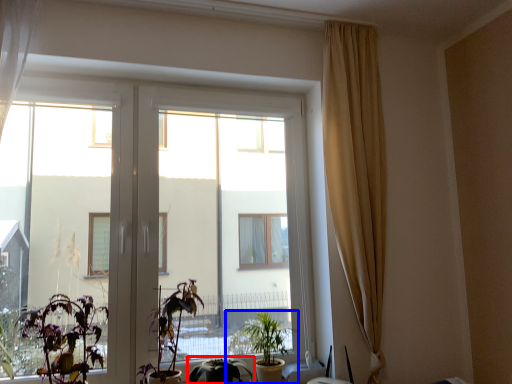
Question: Among these objects, which one is nearest to the camera, houseplant (highlighted by a red box) or houseplant (highlighted by a blue box)?

Choices:
 (A) houseplant
 (B) houseplant

Answer: (A)